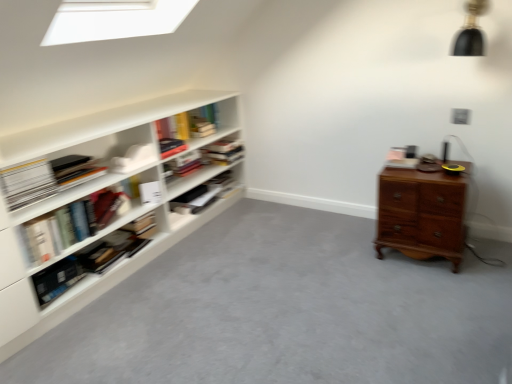
Find the location of a particular element. vacant space to the left of wooden chest of drawers at right is located at coordinates click(353, 258).